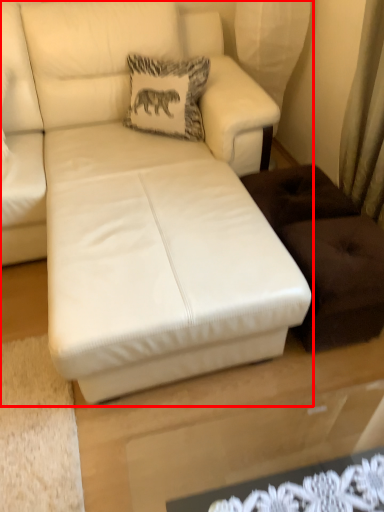
Question: In this image, where is studio couch (annotated by the red box) located relative to pillow?

Choices:
 (A) right
 (B) left

Answer: (A)